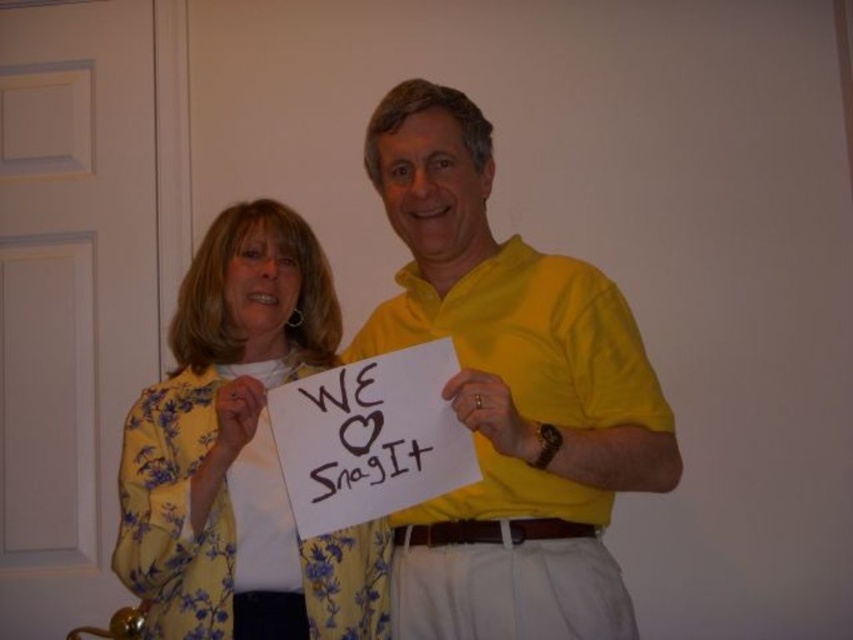
You are a photographer trying to capture a clear photo of the sign held by two people in the image. The yellow matte shirt at center and the yellow floral blouse at center are both in the frame. Which clothing item is positioned higher in the image to help you focus on the sign?

The yellow matte shirt at center is much taller than the yellow floral blouse at center, so the yellow matte shirt at center is positioned higher in the image. This means the photographer should focus on the sign near the higher positioned yellow matte shirt at center.